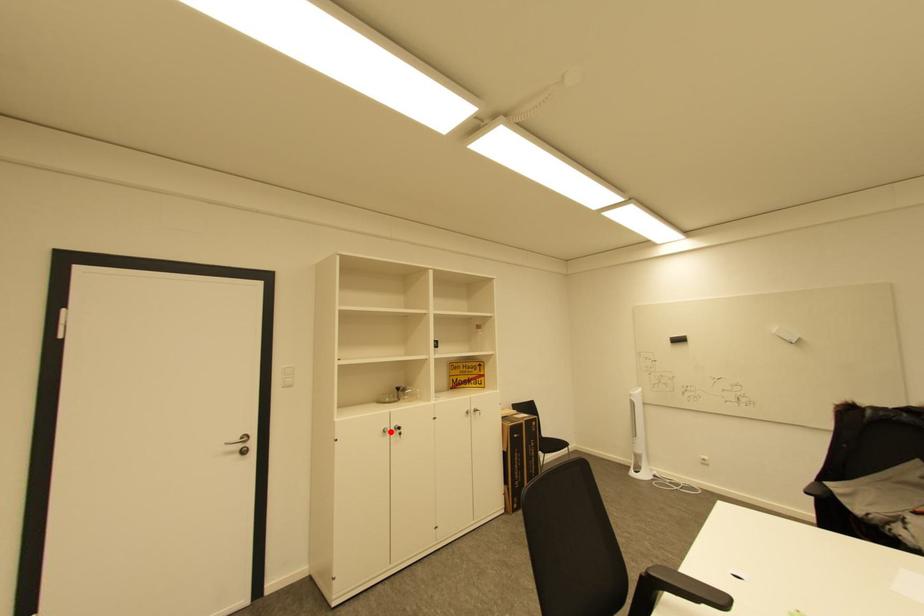
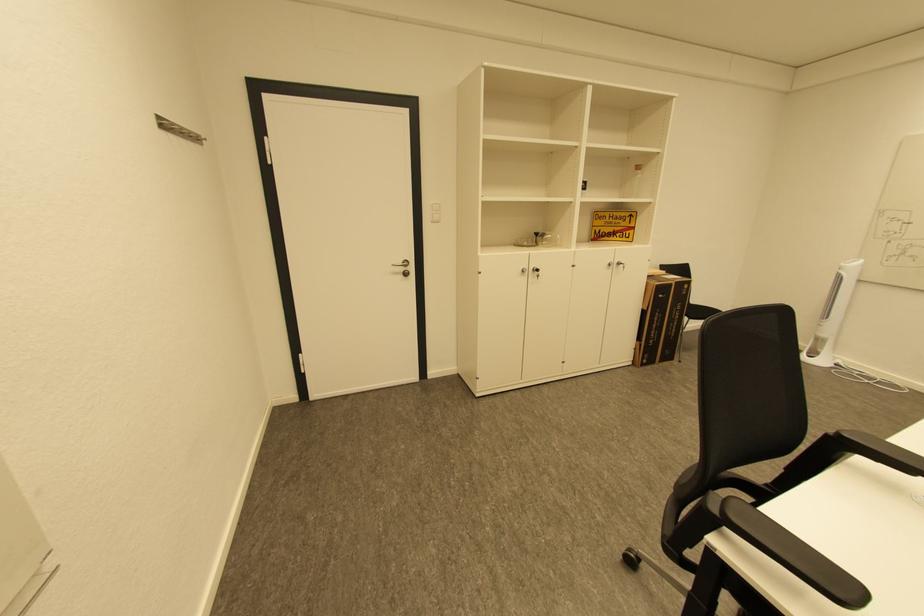
Question: I am providing you with two images of the same scene from different viewpoints. Given a red point in image1, look at the same physical point in image2. Is it:

Choices:
 (A) Closer to the viewpoint
 (B) Farther from the viewpoint

Answer: (A)